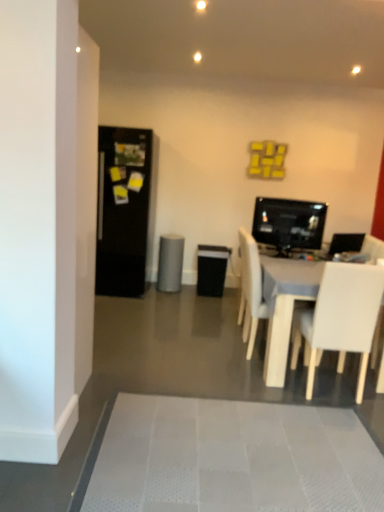
Locate an element on the screen. This screenshot has width=384, height=512. free location above white textured bath mat at lower center (from a real-world perspective) is located at coordinates (242, 447).